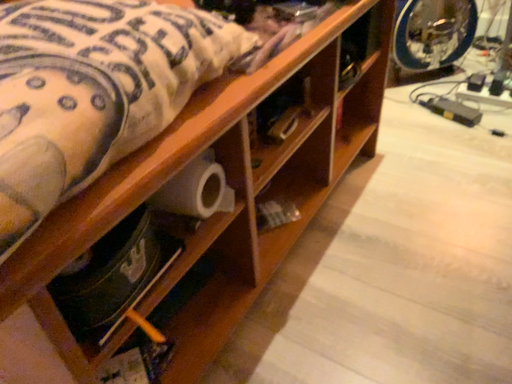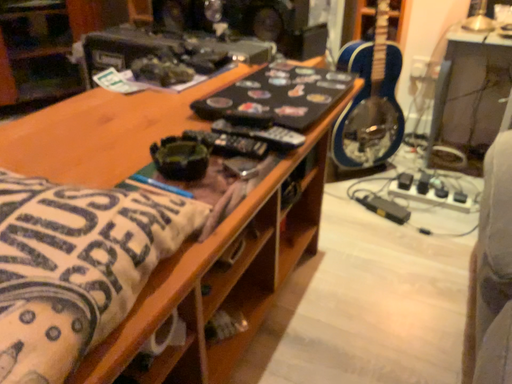
Question: Which way did the camera rotate in the video?

Choices:
 (A) rotated left
 (B) rotated right

Answer: (B)